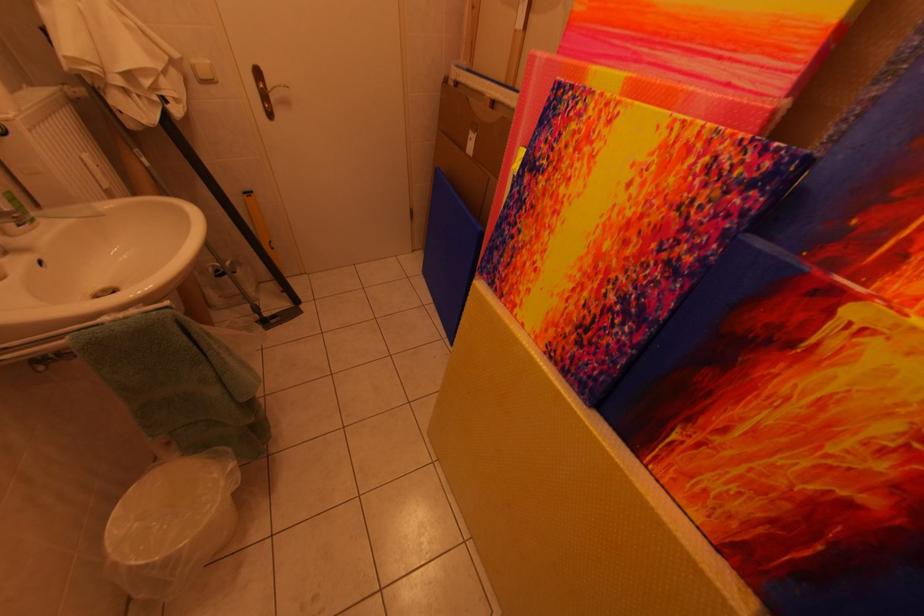
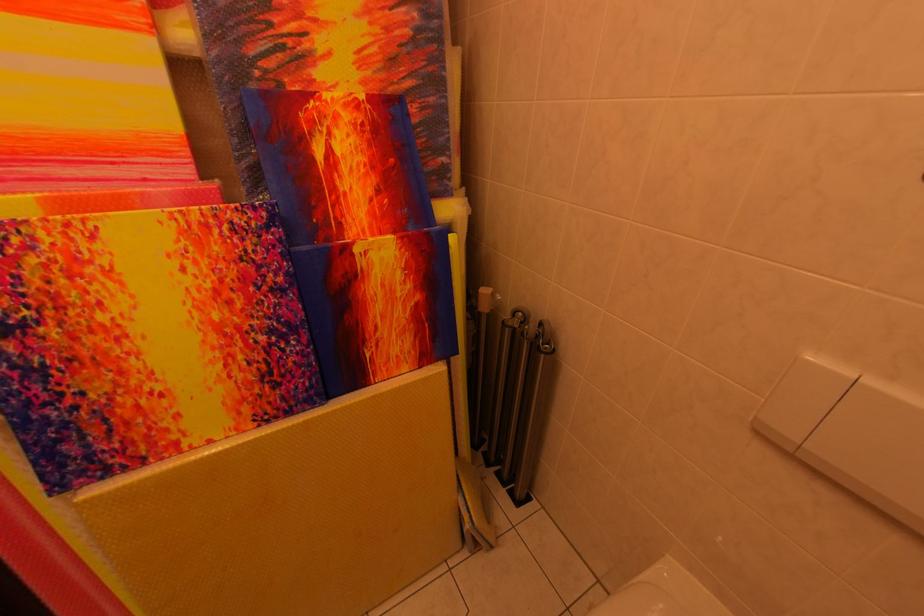
How did the camera likely rotate?

The camera's rotation is toward right-down.